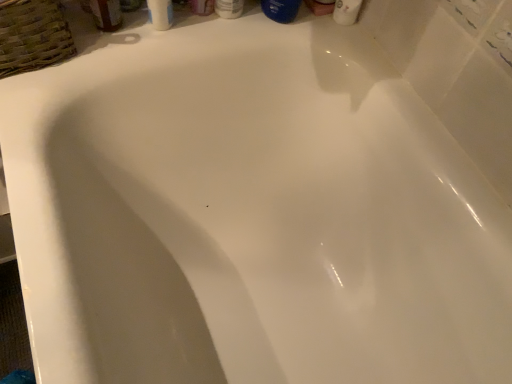
The image size is (512, 384). In order to click on free location to the right of blue glossy bottle at upper center, the second mouthwash in the left-to-right sequence in this screenshot , I will do `click(344, 41)`.